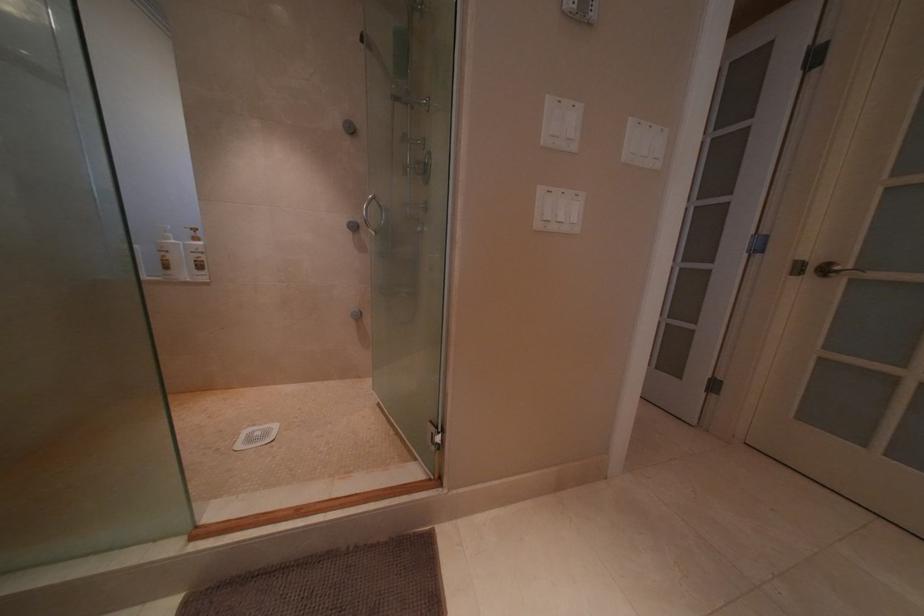
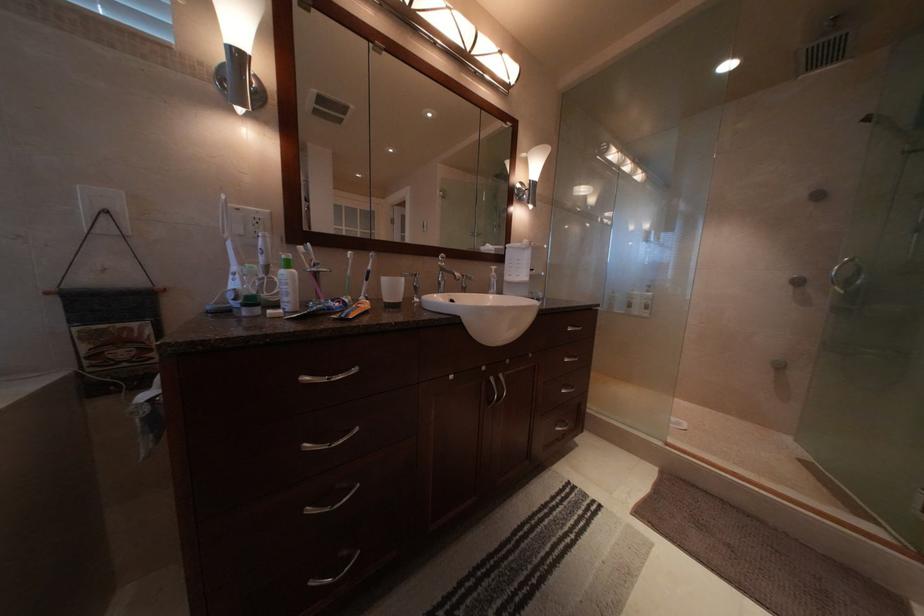
Question: The camera is either moving clockwise (left) or counter-clockwise (right) around the object. The first image is from the beginning of the video and the second image is from the end. Is the camera moving left or right when shooting the video?

Choices:
 (A) Left
 (B) Right

Answer: (B)